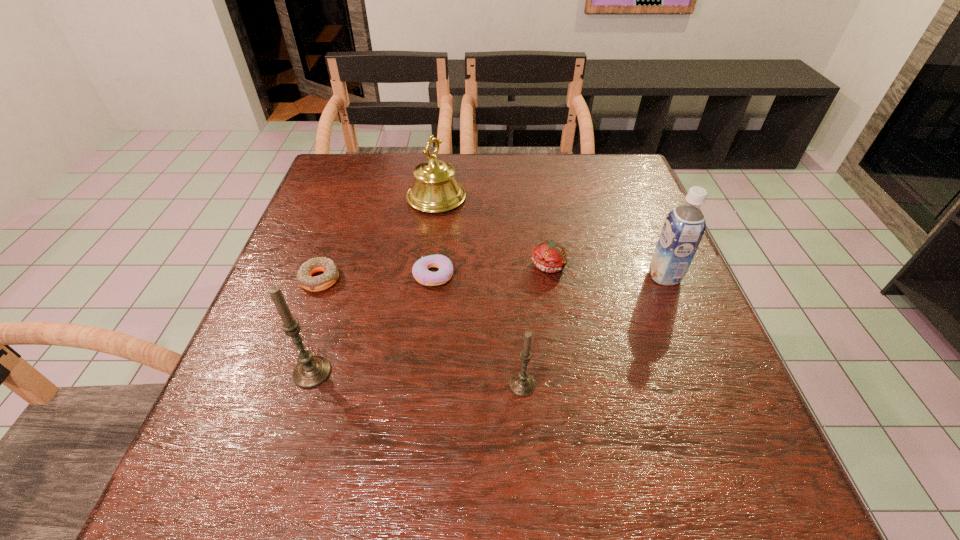
Identify the location of candle at the left edge. (311, 370).

At what (x,y) coordinates should I click in order to perform the action: click on doughnut that is at the left edge. Please return your answer as a coordinate pair (x, y). The image size is (960, 540). Looking at the image, I should click on (330, 276).

You are a GUI agent. You are given a task and a screenshot of the screen. Output one action in this format:
    pyautogui.click(x=<x>, y=<y>)
    Task: Click on the object that is at the right edge
    
    Given the screenshot: What is the action you would take?
    pyautogui.click(x=683, y=229)

Identify the location of object that is at the near left corner. (311, 370).

This screenshot has height=540, width=960. What are the coordinates of `vacant space at the far edge of the desktop` in the screenshot? It's located at (408, 189).

Where is `free space at the near edge`? The width and height of the screenshot is (960, 540). free space at the near edge is located at coordinates pos(509,426).

In the image, there is a desktop. Identify the location of free space at the left edge. This screenshot has height=540, width=960. (247, 351).

This screenshot has width=960, height=540. What are the coordinates of `vacant area at the right edge of the desktop` in the screenshot? It's located at (628, 319).

The image size is (960, 540). Find the location of `free region at the far left corner`. free region at the far left corner is located at coordinates (376, 178).

In the image, there is a desktop. Identify the location of vacant space at the far right corner. This screenshot has height=540, width=960. (596, 159).